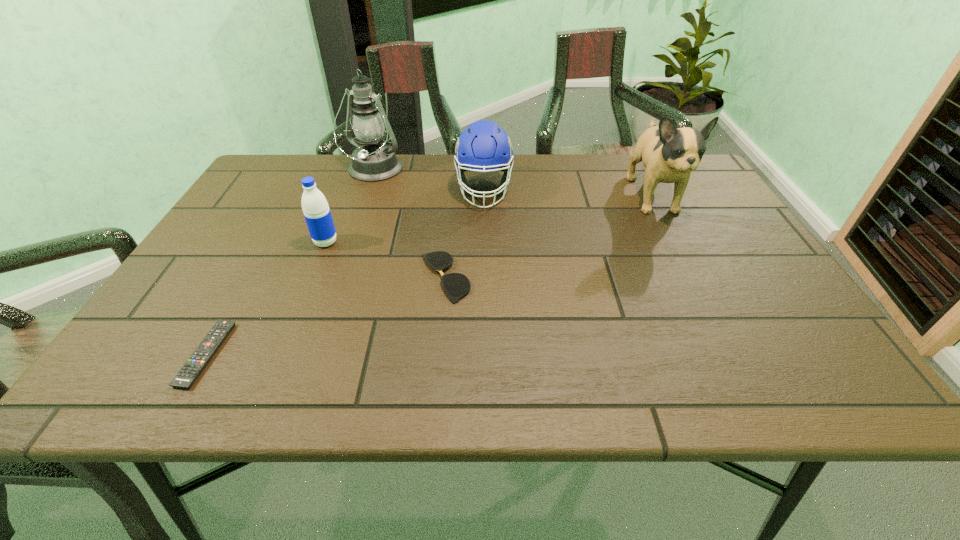
Where is `vacant space that is in between the water bottle and the oil lamp`? The height and width of the screenshot is (540, 960). vacant space that is in between the water bottle and the oil lamp is located at coordinates (349, 206).

What are the coordinates of `free point between the third nearest object and the oil lamp` in the screenshot? It's located at coord(349,206).

You are a GUI agent. You are given a task and a screenshot of the screen. Output one action in this format:
    pyautogui.click(x=<x>, y=<y>)
    Task: Click on the vacant space that's between the football helmet and the fifth farthest object
    Image resolution: width=960 pixels, height=540 pixels.
    Given the screenshot: What is the action you would take?
    pyautogui.click(x=465, y=234)

This screenshot has width=960, height=540. Identify the location of unoccupied position between the spectacles and the leftmost object. (325, 316).

Identify the location of free area in between the nearest object and the water bottle. The width and height of the screenshot is (960, 540). (266, 298).

Find the location of a particular element. Image resolution: width=960 pixels, height=540 pixels. free space that is in between the puppy and the football helmet is located at coordinates (568, 193).

Identify the location of vacant area between the rightmost object and the football helmet. This screenshot has height=540, width=960. (568, 193).

Where is `free area in between the rightmost object and the oil lamp`? The image size is (960, 540). free area in between the rightmost object and the oil lamp is located at coordinates (513, 184).

Identify which object is located as the fifth nearest to the puppy. Please provide its 2D coordinates. Your answer should be formatted as a tuple, i.e. [(x, y)], where the tuple contains the x and y coordinates of a point satisfying the conditions above.

[(187, 375)]

You are a GUI agent. You are given a task and a screenshot of the screen. Output one action in this format:
    pyautogui.click(x=<x>, y=<y>)
    Task: Click on the object identified as the fourth closest to the puppy
    The width and height of the screenshot is (960, 540).
    Given the screenshot: What is the action you would take?
    pyautogui.click(x=315, y=207)